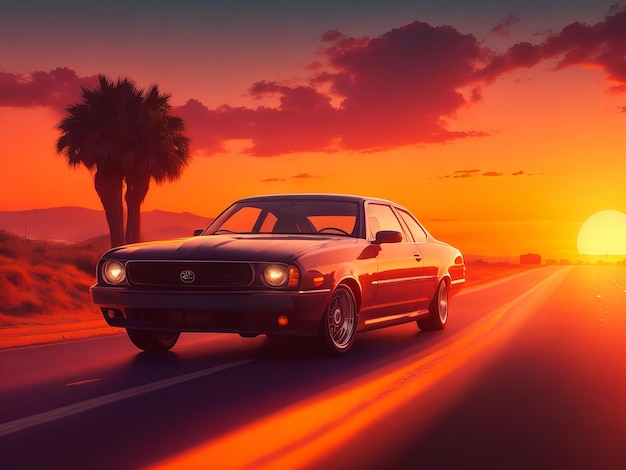
Where is `left mirror`? left mirror is located at coordinates (386, 236).